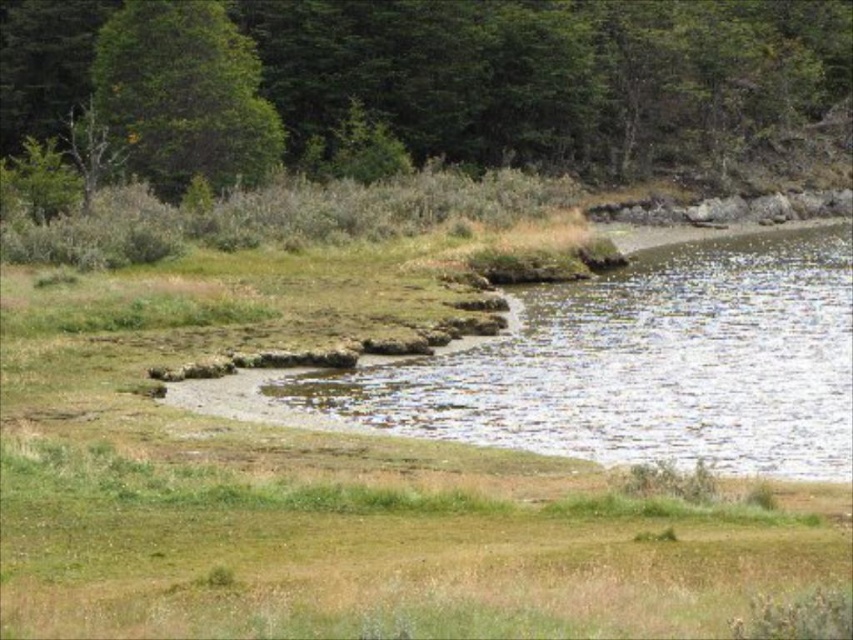
Question: Considering the real-world distances, which object is closest to the green leafy tree at upper left?

Choices:
 (A) green leafy tree at upper center
 (B) clear water at lower right

Answer: (A)

Question: Is green leafy tree at upper center wider than clear water at lower right?

Choices:
 (A) no
 (B) yes

Answer: (B)

Question: Which point is closer to the camera?

Choices:
 (A) (305, 54)
 (B) (129, 65)
 (C) (589, 451)

Answer: (C)

Question: Which of the following is the closest to the observer?

Choices:
 (A) click(508, 83)
 (B) click(766, 380)
 (C) click(126, 132)

Answer: (B)

Question: Is clear water at lower right above green leafy tree at upper left?

Choices:
 (A) no
 (B) yes

Answer: (A)

Question: Observing the image, what is the correct spatial positioning of clear water at lower right in reference to green leafy tree at upper left?

Choices:
 (A) left
 (B) right

Answer: (B)